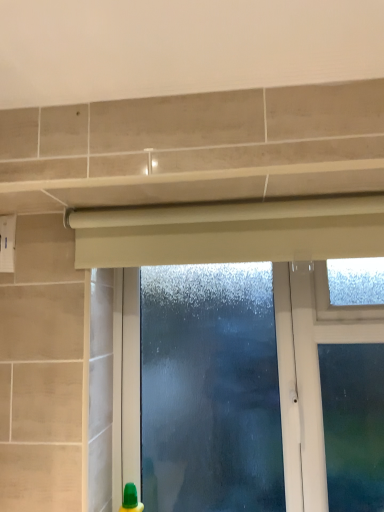
At what (x,y) coordinates should I click in order to perform the action: click on beige matte curtain at upper center. Please return your answer as a coordinate pair (x, y). This screenshot has height=512, width=384. Looking at the image, I should click on (229, 232).

In the scene shown: What is the approximate width of beige matte curtain at upper center?

beige matte curtain at upper center is 7.22 centimeters wide.

What do you see at coordinates (229, 232) in the screenshot?
I see `beige matte curtain at upper center` at bounding box center [229, 232].

The image size is (384, 512). Describe the element at coordinates (230, 232) in the screenshot. I see `frosted glass window at center` at that location.

Locate an element on the screen. Image resolution: width=384 pixels, height=512 pixels. frosted glass window at center is located at coordinates 230,232.

Locate an element on the screen. The image size is (384, 512). beige matte curtain at upper center is located at coordinates (229, 232).

Can you confirm if beige matte curtain at upper center is positioned to the left of frosted glass window at center?

Indeed, beige matte curtain at upper center is positioned on the left side of frosted glass window at center.

Looking at this image, relative to frosted glass window at center, is beige matte curtain at upper center in front or behind?

beige matte curtain at upper center is positioned closer to the viewer than frosted glass window at center.

Considering the positions of points (176, 218) and (182, 256), is point (176, 218) closer to camera compared to point (182, 256)?

Yes.

From the image's perspective, which is above, beige matte curtain at upper center or frosted glass window at center?

beige matte curtain at upper center.

From a real-world perspective, is beige matte curtain at upper center physically above frosted glass window at center?

Indeed, from a real-world perspective, beige matte curtain at upper center stands above frosted glass window at center.

Considering the relative sizes of beige matte curtain at upper center and frosted glass window at center in the image provided, is beige matte curtain at upper center thinner than frosted glass window at center?

Yes.

Which of these two, beige matte curtain at upper center or frosted glass window at center, stands taller?

Standing taller between the two is frosted glass window at center.

Which of these two, beige matte curtain at upper center or frosted glass window at center, is bigger?

Bigger between the two is frosted glass window at center.

Do you think beige matte curtain at upper center is within frosted glass window at center, or outside of it?

The correct answer is: outside.

Does beige matte curtain at upper center touch frosted glass window at center?

Yes, beige matte curtain at upper center is touching frosted glass window at center.

From the picture: Is beige matte curtain at upper center oriented away from frosted glass window at center?

No, beige matte curtain at upper center is not facing away from frosted glass window at center.

Can you tell me how much beige matte curtain at upper center and frosted glass window at center differ in facing direction?

The facing directions of beige matte curtain at upper center and frosted glass window at center are 0.00146 degrees apart.

Measure the distance between beige matte curtain at upper center and frosted glass window at center.

beige matte curtain at upper center is 0.26 inches away from frosted glass window at center.

Identify the location of window behind the beige matte curtain at upper center. The image size is (384, 512). (230, 232).

Based on the photo, considering the relative positions of frosted glass window at center and beige matte curtain at upper center in the image provided, is frosted glass window at center to the right of beige matte curtain at upper center from the viewer's perspective?

Indeed, frosted glass window at center is positioned on the right side of beige matte curtain at upper center.

Consider the image. Considering the positions of objects frosted glass window at center and beige matte curtain at upper center in the image provided, who is in front, frosted glass window at center or beige matte curtain at upper center?

beige matte curtain at upper center is more forward.

Is point (292, 253) closer to camera compared to point (256, 234)?

Yes, it is in front of point (256, 234).

From the image's perspective, is frosted glass window at center beneath beige matte curtain at upper center?

Correct, frosted glass window at center appears lower than beige matte curtain at upper center in the image.

From a real-world perspective, is frosted glass window at center positioned under beige matte curtain at upper center based on gravity?

Correct, in the physical world, frosted glass window at center is lower than beige matte curtain at upper center.

Between frosted glass window at center and beige matte curtain at upper center, which one has larger width?

frosted glass window at center is wider.

Which of these two, frosted glass window at center or beige matte curtain at upper center, stands shorter?

With less height is beige matte curtain at upper center.

Considering the sizes of objects frosted glass window at center and beige matte curtain at upper center in the image provided, who is smaller, frosted glass window at center or beige matte curtain at upper center?

With smaller size is beige matte curtain at upper center.

Choose the correct answer: Is frosted glass window at center inside beige matte curtain at upper center or outside it?

frosted glass window at center is located beyond the bounds of beige matte curtain at upper center.

Consider the image. Are frosted glass window at center and beige matte curtain at upper center located far from each other?

No.

Is frosted glass window at center positioned with its back to beige matte curtain at upper center?

frosted glass window at center is not turned away from beige matte curtain at upper center.

How different are the orientations of frosted glass window at center and beige matte curtain at upper center in degrees?

There is a 0.00146-degree angle between the facing directions of frosted glass window at center and beige matte curtain at upper center.

How far apart are frosted glass window at center and beige matte curtain at upper center?

A distance of 0.26 inches exists between frosted glass window at center and beige matte curtain at upper center.

In order to click on window behind the beige matte curtain at upper center in this screenshot , I will do `click(230, 232)`.

The width and height of the screenshot is (384, 512). I want to click on window behind the beige matte curtain at upper center, so click(230, 232).

Locate an element on the screen. curtain above the frosted glass window at center (from the image's perspective) is located at coordinates (229, 232).